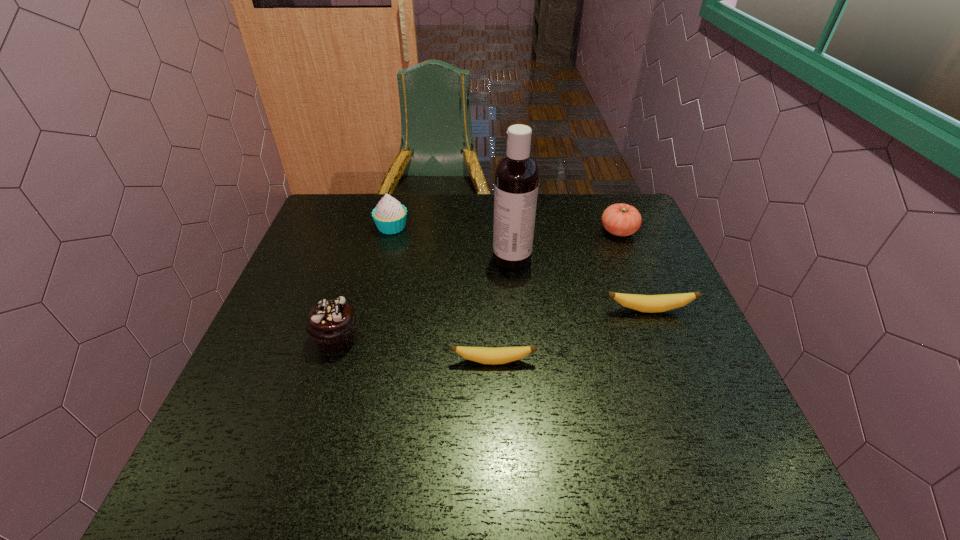
Identify the location of the left banana. The height and width of the screenshot is (540, 960). (500, 355).

Locate an element on the screen. The height and width of the screenshot is (540, 960). the nearer banana is located at coordinates (500, 355).

You are a GUI agent. You are given a task and a screenshot of the screen. Output one action in this format:
    pyautogui.click(x=<x>, y=<y>)
    Task: Click on the farther banana
    
    Given the screenshot: What is the action you would take?
    pyautogui.click(x=644, y=303)

Locate an element on the screen. The height and width of the screenshot is (540, 960). the fifth tallest object is located at coordinates [x=644, y=303].

Where is `the farther cupcake`? The image size is (960, 540). the farther cupcake is located at coordinates (390, 216).

At what (x,y) coordinates should I click in order to perform the action: click on the fourth nearest object. Please return your answer as a coordinate pair (x, y). Image resolution: width=960 pixels, height=540 pixels. Looking at the image, I should click on (516, 183).

I want to click on the tallest object, so click(516, 183).

The width and height of the screenshot is (960, 540). In order to click on the third shortest object in this screenshot , I will do `click(621, 219)`.

At what (x,y) coordinates should I click in order to perform the action: click on the nearer cupcake. Please return your answer as a coordinate pair (x, y). The width and height of the screenshot is (960, 540). Looking at the image, I should click on (331, 324).

The width and height of the screenshot is (960, 540). In order to click on free space located on the left of the shortest object in this screenshot , I will do `click(416, 361)`.